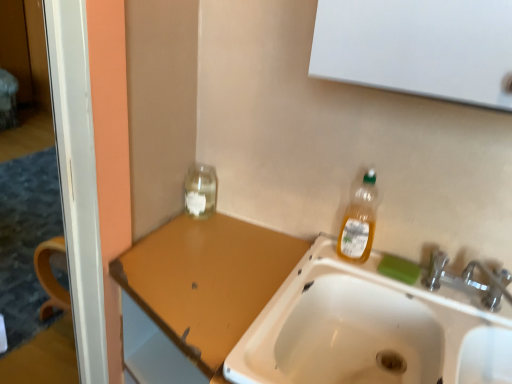
Where is `vacant space to the right of transparent glass jar at upper left`? vacant space to the right of transparent glass jar at upper left is located at coordinates (238, 231).